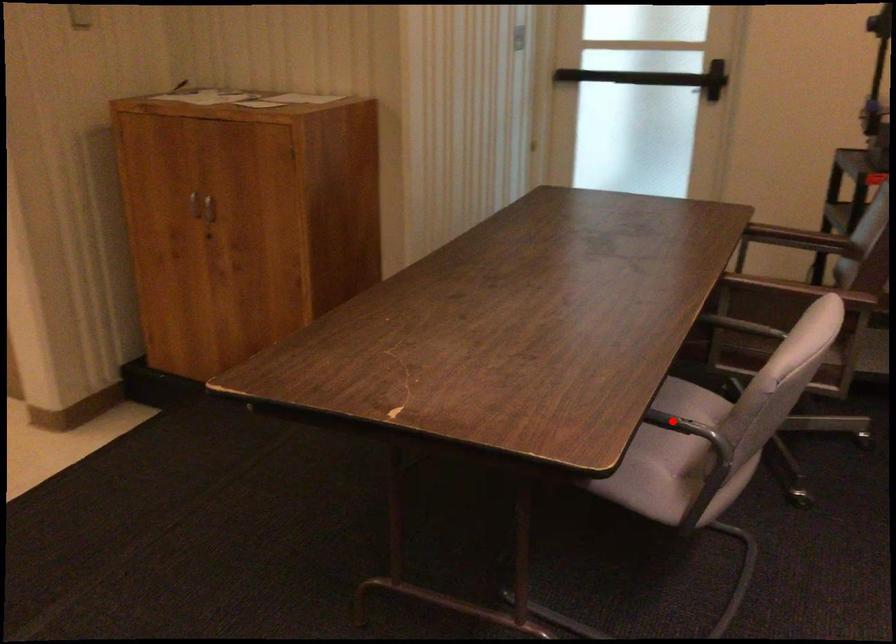
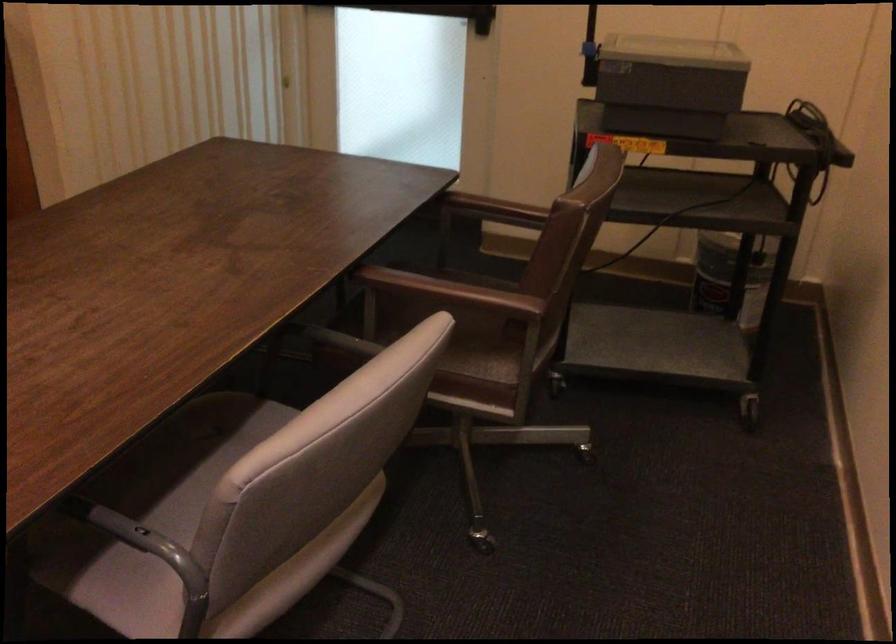
Question: I am providing you with two images of the same scene from different viewpoints. In image1, a red point is highlighted. Considering the same 3D point in image2, which of the following is correct?

Choices:
 (A) It is closer
 (B) It is farther

Answer: (A)